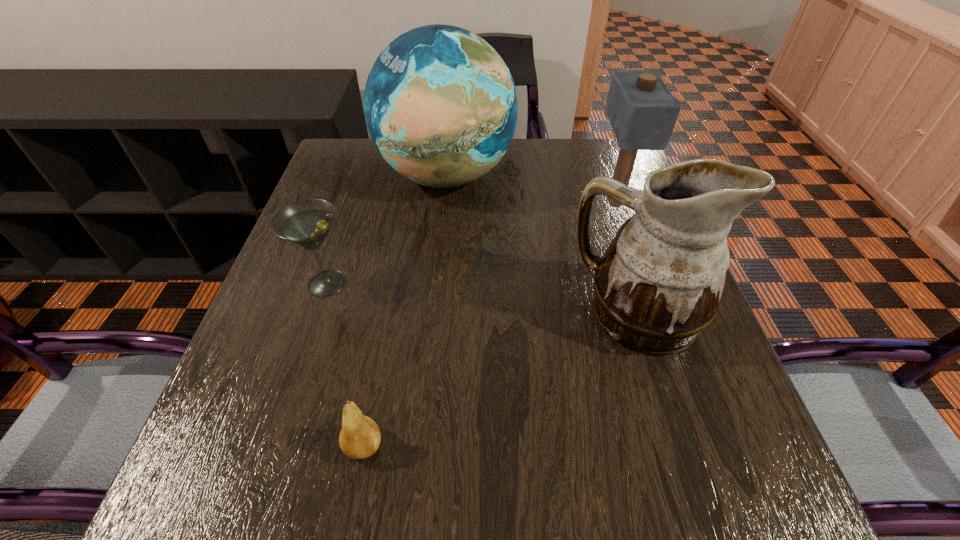
The image size is (960, 540). What are the coordinates of `free spot between the fourth tallest object and the globe` in the screenshot? It's located at (387, 230).

Find the location of a particular element. empty space that is in between the shortest object and the globe is located at coordinates (405, 310).

The width and height of the screenshot is (960, 540). In order to click on vacant region between the martini and the mallet in this screenshot , I will do `click(471, 243)`.

Image resolution: width=960 pixels, height=540 pixels. I want to click on vacant area that lies between the globe and the martini, so click(x=387, y=230).

Identify the location of free space between the second shortest object and the mallet. Image resolution: width=960 pixels, height=540 pixels. (471, 243).

Find the location of `free space between the pear and the pitcher`. free space between the pear and the pitcher is located at coordinates (500, 380).

You are a GUI agent. You are given a task and a screenshot of the screen. Output one action in this format:
    pyautogui.click(x=<x>, y=<y>)
    Task: Click on the object that is the closest one to the martini
    
    Given the screenshot: What is the action you would take?
    pyautogui.click(x=440, y=104)

At what (x,y) coordinates should I click in order to perform the action: click on the second closest object to the globe. Please return your answer as a coordinate pair (x, y). This screenshot has height=540, width=960. Looking at the image, I should click on (642, 111).